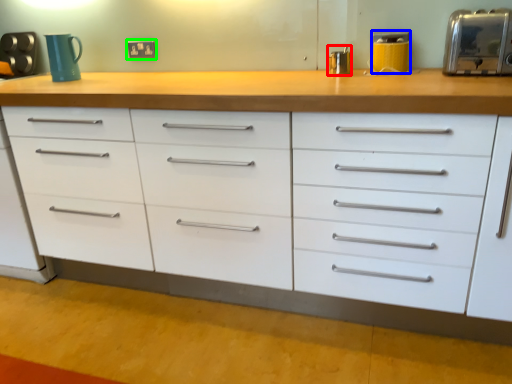
Question: Which object is positioned farthest from appliance (highlighted by a red box)? Select from appliance (highlighted by a blue box) and electric outlet (highlighted by a green box).

Choices:
 (A) appliance
 (B) electric outlet

Answer: (B)